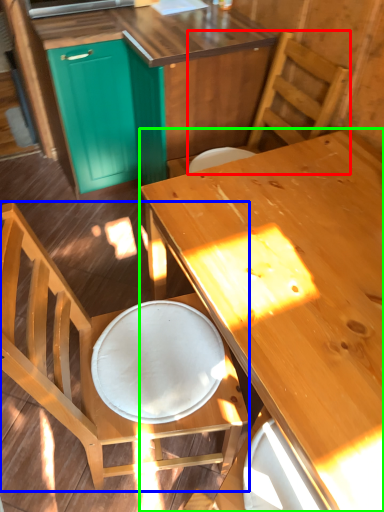
Question: Estimate the real-world distances between objects in this image. Which object is closer to chair (highlighted by a red box), chair (highlighted by a blue box) or desk (highlighted by a green box)?

Choices:
 (A) chair
 (B) desk

Answer: (B)